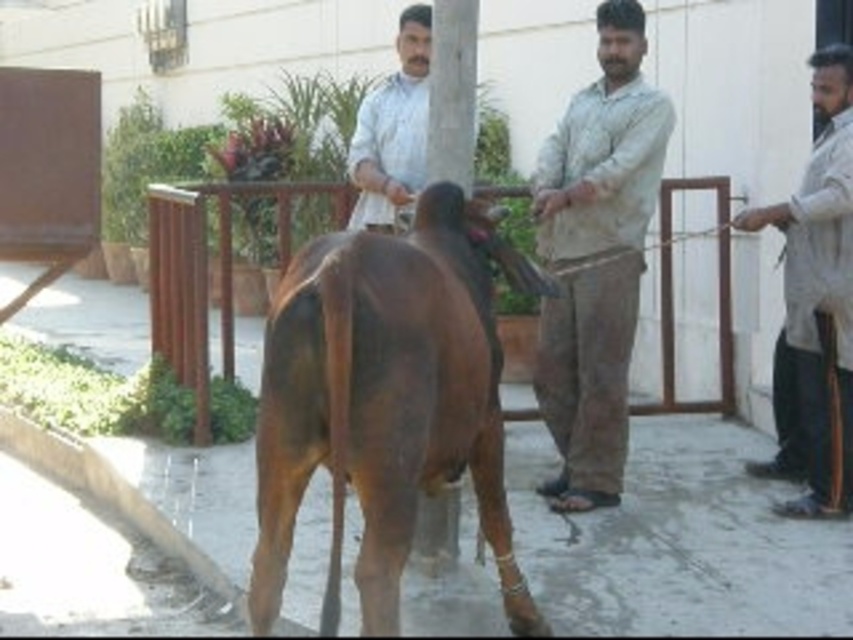
You are a photographer trying to capture a candid shot of the two men in the scene. You notice the light beige cotton shirt at center and the white matte shirt at center. Which one is positioned higher in the frame?

The light beige cotton shirt at center is positioned higher in the frame as it is much taller than the white matte shirt at center.

Looking at this image, you are a photographer trying to capture the brown glossy bull at center and the light beige shirt at right in the same frame. Based on their sizes, which one should you focus on to ensure both fit in the photo?

The brown glossy bull at center is wider than the light beige shirt at right, so focusing on the bull will ensure both fit in the photo as it occupies more space.

You are a photographer trying to capture a photo of the brown glossy bull at center and the light beige shirt at right. Since you want both subjects to appear in the frame, which subject should you focus on first to ensure they both fit in the photo?

The brown glossy bull at center is bigger than the light beige shirt at right, so you should focus on the brown glossy bull at center first to ensure both fit in the frame.